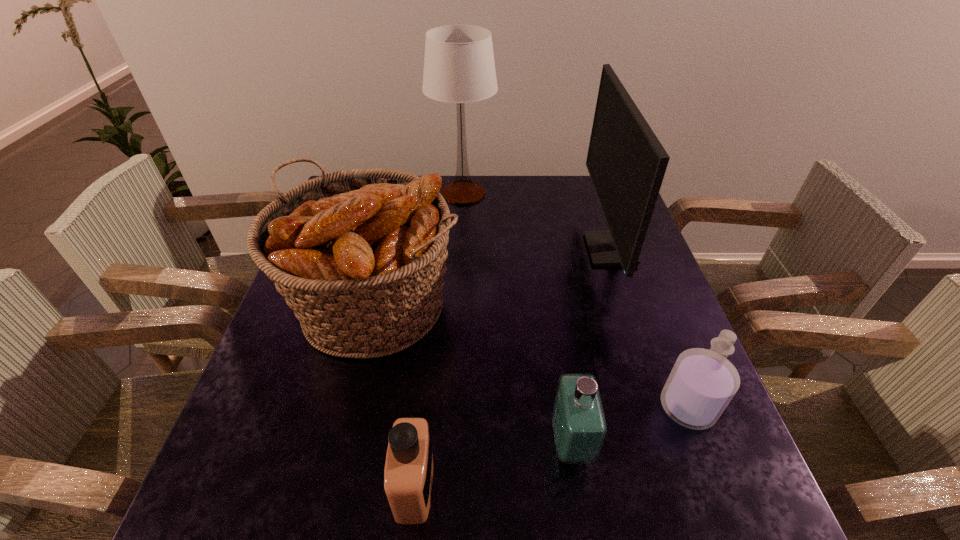
The height and width of the screenshot is (540, 960). I want to click on computer monitor situated at the right edge, so click(626, 162).

Locate an element on the screen. perfume at the right edge is located at coordinates [x=702, y=383].

You are a GUI agent. You are given a task and a screenshot of the screen. Output one action in this format:
    pyautogui.click(x=<x>, y=<y>)
    Task: Click on the object that is at the far right corner
    This screenshot has height=540, width=960.
    Given the screenshot: What is the action you would take?
    pyautogui.click(x=626, y=162)

Identify the location of vacant space at the near edge. (348, 536).

In the image, there is a desktop. Where is `free space at the right edge`? The image size is (960, 540). free space at the right edge is located at coordinates (669, 481).

Where is `vacant space at the far right corner`? The height and width of the screenshot is (540, 960). vacant space at the far right corner is located at coordinates (601, 215).

At what (x,y) coordinates should I click in order to perform the action: click on free space between the table lamp and the computer monitor. Please return your answer as a coordinate pair (x, y). This screenshot has height=540, width=960. Looking at the image, I should click on (537, 221).

You are a GUI agent. You are given a task and a screenshot of the screen. Output one action in this format:
    pyautogui.click(x=<x>, y=<y>)
    Task: Click on the empty space that is in between the fourth object from left to right and the computer monitor
    This screenshot has width=960, height=540.
    Given the screenshot: What is the action you would take?
    pyautogui.click(x=590, y=347)

In order to click on empty location between the rightmost perfume and the leftmost perfume in this screenshot , I will do `click(551, 446)`.

The image size is (960, 540). Identify the location of vacant area between the leftmost perfume and the computer monitor. (513, 367).